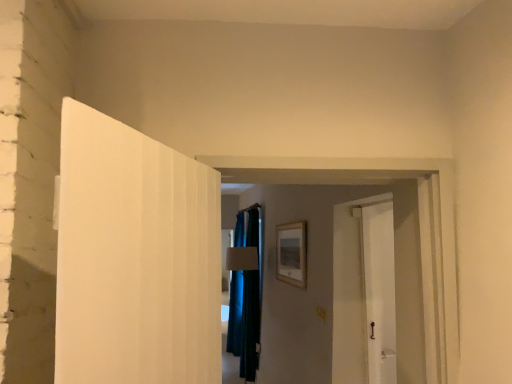
Question: Is point coord(257,238) positioned closer to the camera than point coord(292,261)?

Choices:
 (A) closer
 (B) farther

Answer: (B)

Question: Considering the positions of dark blue fabric at center and wooden picture frame at center in the image, is dark blue fabric at center taller or shorter than wooden picture frame at center?

Choices:
 (A) tall
 (B) short

Answer: (A)

Question: Is dark blue fabric at center spatially inside wooden picture frame at center, or outside of it?

Choices:
 (A) outside
 (B) inside

Answer: (A)

Question: From the image's perspective, is wooden picture frame at center located above or below dark blue fabric at center?

Choices:
 (A) below
 (B) above

Answer: (B)

Question: Considering the positions of wooden picture frame at center and dark blue fabric at center in the image, is wooden picture frame at center bigger or smaller than dark blue fabric at center?

Choices:
 (A) small
 (B) big

Answer: (A)

Question: Choose the correct answer: Is wooden picture frame at center inside dark blue fabric at center or outside it?

Choices:
 (A) outside
 (B) inside

Answer: (A)

Question: Relative to dark blue fabric at center, is wooden picture frame at center in front or behind?

Choices:
 (A) behind
 (B) front

Answer: (B)